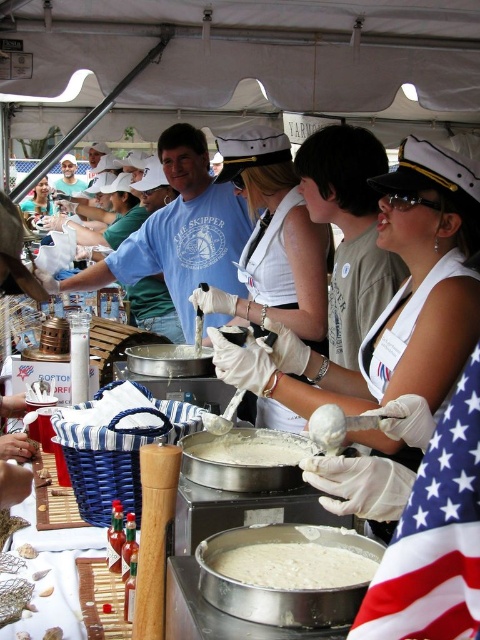
You are a participant in the cooking event and need to determine if your hand can fit into the white matte gloves at center while holding the white creamy substance at center. Based on the size comparison, is this possible?

The white matte gloves at center are larger in size than the white creamy substance at center, so yes, your hand can fit into the white matte gloves at center while holding the white creamy substance at center.